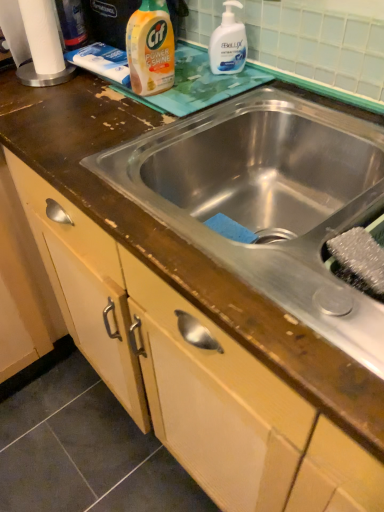
Question: Is white paper towel at upper left bigger than white glossy hand soap at upper right, which ranks as the second cleaning product in left-to-right order?

Choices:
 (A) yes
 (B) no

Answer: (A)

Question: Are white paper towel at upper left and white glossy hand soap at upper right, the first cleaning product when ordered from right to left, located far from each other?

Choices:
 (A) yes
 (B) no

Answer: (B)

Question: Is white paper towel at upper left oriented towards white glossy hand soap at upper right, which ranks as the second cleaning product in left-to-right order?

Choices:
 (A) no
 (B) yes

Answer: (A)

Question: From the image's perspective, is white paper towel at upper left below white glossy hand soap at upper right, the first cleaning product when ordered from right to left?

Choices:
 (A) yes
 (B) no

Answer: (B)

Question: Is white glossy hand soap at upper right, which ranks as the second cleaning product in left-to-right order, completely or partially inside white paper towel at upper left?

Choices:
 (A) no
 (B) yes

Answer: (A)

Question: Is white paper towel at upper left positioned beyond the bounds of white glossy hand soap at upper right, the first cleaning product when ordered from right to left?

Choices:
 (A) no
 (B) yes

Answer: (B)

Question: Is white glossy hand soap at upper right, the first cleaning product when ordered from right to left, thinner than white paper towel at upper left?

Choices:
 (A) yes
 (B) no

Answer: (A)

Question: Is white paper towel at upper left completely or partially inside white glossy hand soap at upper right, the first cleaning product when ordered from right to left?

Choices:
 (A) no
 (B) yes

Answer: (A)

Question: Does white glossy hand soap at upper right, the first cleaning product when ordered from right to left, have a greater height compared to white paper towel at upper left?

Choices:
 (A) no
 (B) yes

Answer: (B)

Question: Is white glossy hand soap at upper right, which ranks as the second cleaning product in left-to-right order, to the right of white paper towel at upper left from the viewer's perspective?

Choices:
 (A) yes
 (B) no

Answer: (A)

Question: From a real-world perspective, is white glossy hand soap at upper right, the first cleaning product when ordered from right to left, beneath white paper towel at upper left?

Choices:
 (A) yes
 (B) no

Answer: (B)

Question: Could you tell me if white glossy hand soap at upper right, the first cleaning product when ordered from right to left, is turned towards white paper towel at upper left?

Choices:
 (A) yes
 (B) no

Answer: (B)

Question: Is stainless steel sink at center further to the viewer compared to yellow plastic bottle at upper center, marked as the first cleaning product in a left-to-right arrangement?

Choices:
 (A) no
 (B) yes

Answer: (A)